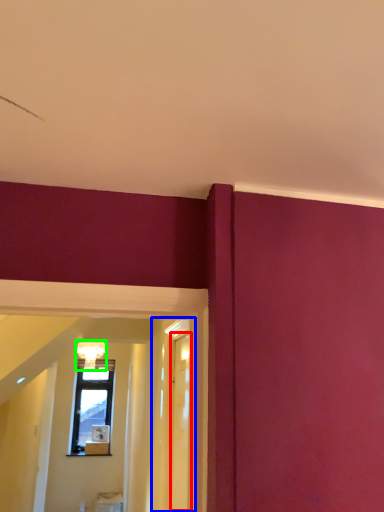
Question: Which is farther away from glass door (highlighted by a red box)? glass door (highlighted by a blue box) or light fixture (highlighted by a green box)?

Choices:
 (A) glass door
 (B) light fixture

Answer: (B)